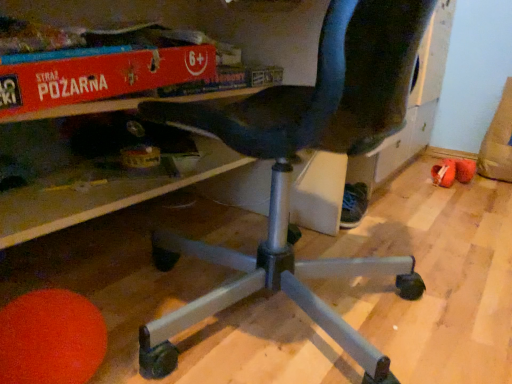
Question: Which direction should I rotate to look at black fabric shoe at lower center, the 1th footwear in the left-to-right sequence?

Choices:
 (A) left
 (B) right

Answer: (B)

Question: Can you confirm if black plastic chair at center is smaller than orange fabric shoe at lower right, which is the first footwear in back-to-front order?

Choices:
 (A) no
 (B) yes

Answer: (A)

Question: From the image's perspective, is black plastic chair at center above orange fabric shoe at lower right, marked as the 1th footwear in a right-to-left arrangement?

Choices:
 (A) no
 (B) yes

Answer: (A)

Question: Is black plastic chair at center looking in the opposite direction of orange fabric shoe at lower right, marked as the 1th footwear in a right-to-left arrangement?

Choices:
 (A) yes
 (B) no

Answer: (B)

Question: Considering the relative positions of black plastic chair at center and orange fabric shoe at lower right, marked as the 1th footwear in a right-to-left arrangement, in the image provided, is black plastic chair at center to the left of orange fabric shoe at lower right, marked as the 1th footwear in a right-to-left arrangement, from the viewer's perspective?

Choices:
 (A) yes
 (B) no

Answer: (A)

Question: Is black plastic chair at center not close to orange fabric shoe at lower right, marked as the second footwear in a front-to-back arrangement?

Choices:
 (A) yes
 (B) no

Answer: (A)

Question: Can you confirm if black plastic chair at center is thinner than orange fabric shoe at lower right, marked as the 1th footwear in a right-to-left arrangement?

Choices:
 (A) no
 (B) yes

Answer: (A)

Question: Is orange fabric shoe at lower right, which is the first footwear in back-to-front order, positioned in front of brown suede bean bag at lower right?

Choices:
 (A) yes
 (B) no

Answer: (B)

Question: Does orange fabric shoe at lower right, marked as the second footwear in a front-to-back arrangement, have a greater width compared to brown suede bean bag at lower right?

Choices:
 (A) no
 (B) yes

Answer: (A)

Question: From a real-world perspective, is orange fabric shoe at lower right, placed as the second footwear when sorted from left to right, positioned over brown suede bean bag at lower right based on gravity?

Choices:
 (A) yes
 (B) no

Answer: (B)

Question: From the image's perspective, is orange fabric shoe at lower right, marked as the second footwear in a front-to-back arrangement, located beneath brown suede bean bag at lower right?

Choices:
 (A) no
 (B) yes

Answer: (B)

Question: Considering the relative positions of orange fabric shoe at lower right, marked as the second footwear in a front-to-back arrangement, and brown suede bean bag at lower right in the image provided, is orange fabric shoe at lower right, marked as the second footwear in a front-to-back arrangement, to the right of brown suede bean bag at lower right from the viewer's perspective?

Choices:
 (A) yes
 (B) no

Answer: (B)

Question: From a real-world perspective, is orange fabric shoe at lower right, placed as the second footwear when sorted from left to right, physically below brown suede bean bag at lower right?

Choices:
 (A) yes
 (B) no

Answer: (A)

Question: Can you confirm if brown suede bean bag at lower right is wider than red cardboard box at upper center?

Choices:
 (A) yes
 (B) no

Answer: (A)